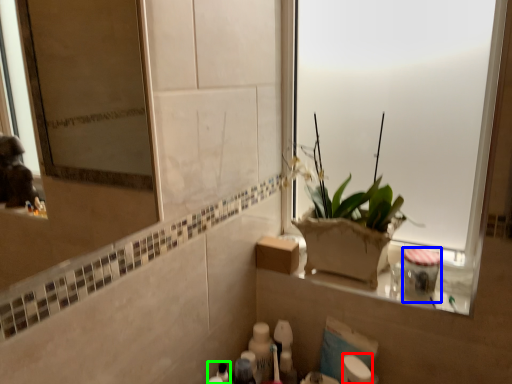
Question: Which object is the closest to the toilet paper (highlighted by a red box)? Choose among these: toiletry (highlighted by a blue box) or toiletry (highlighted by a green box).

Choices:
 (A) toiletry
 (B) toiletry

Answer: (A)